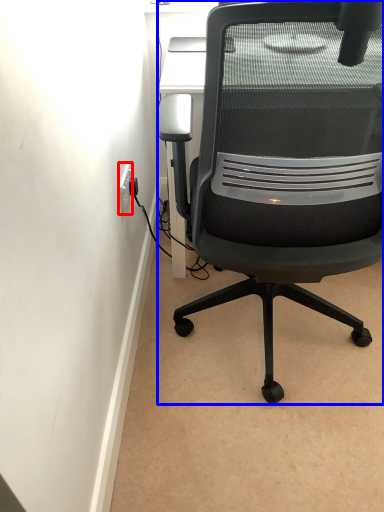
Question: Which point is further to the camera, electric outlet (highlighted by a red box) or chair (highlighted by a blue box)?

Choices:
 (A) electric outlet
 (B) chair

Answer: (A)